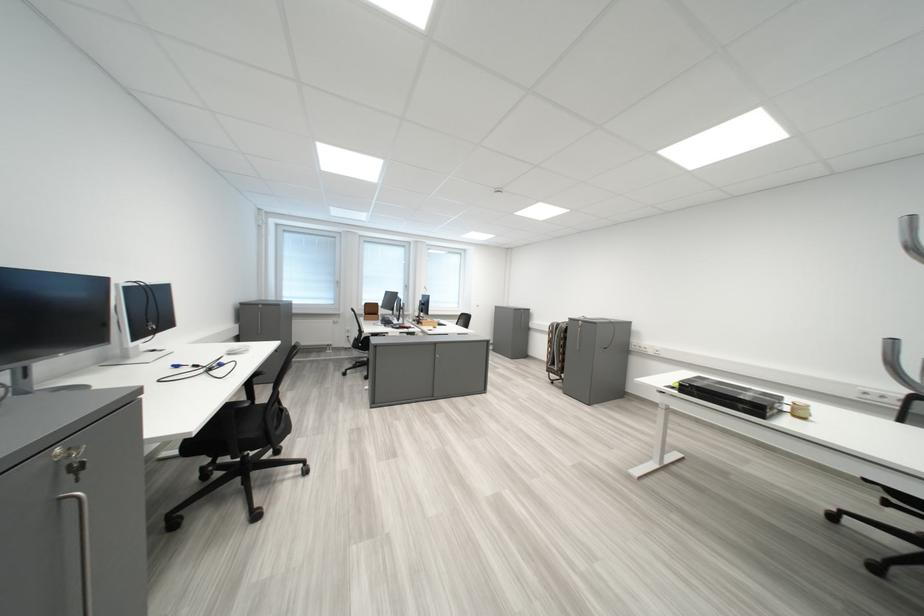
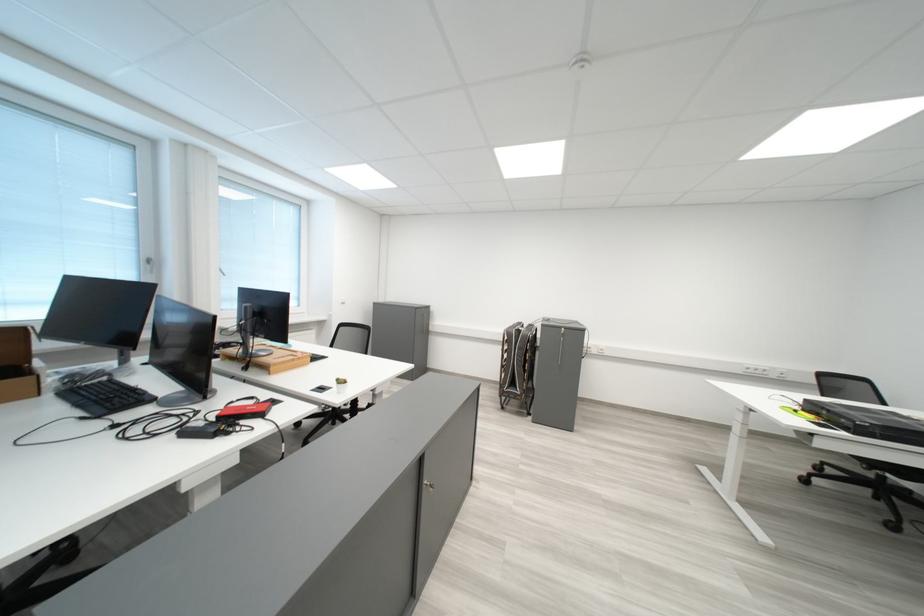
Find the pixel in the second image that matches [566,365] in the first image.

(526, 387)